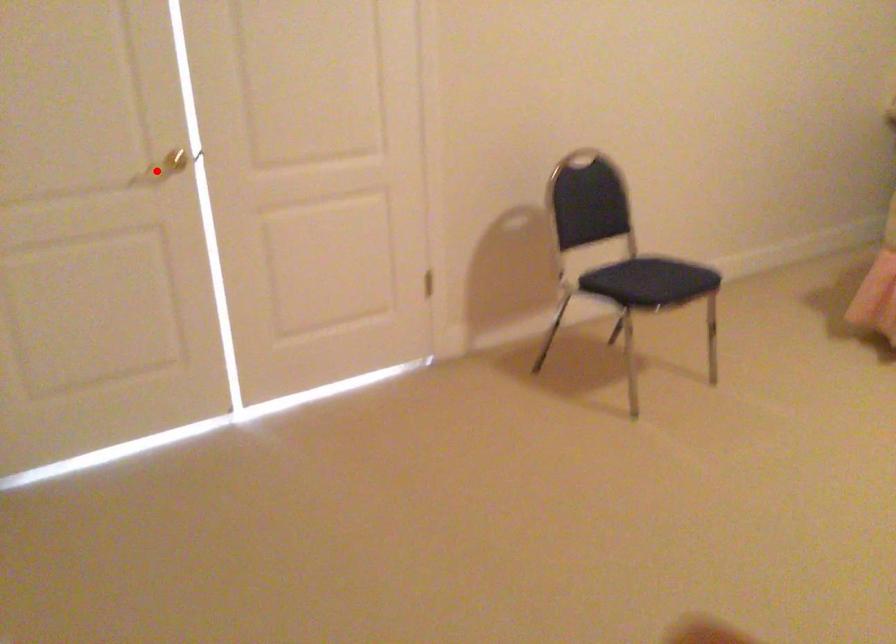
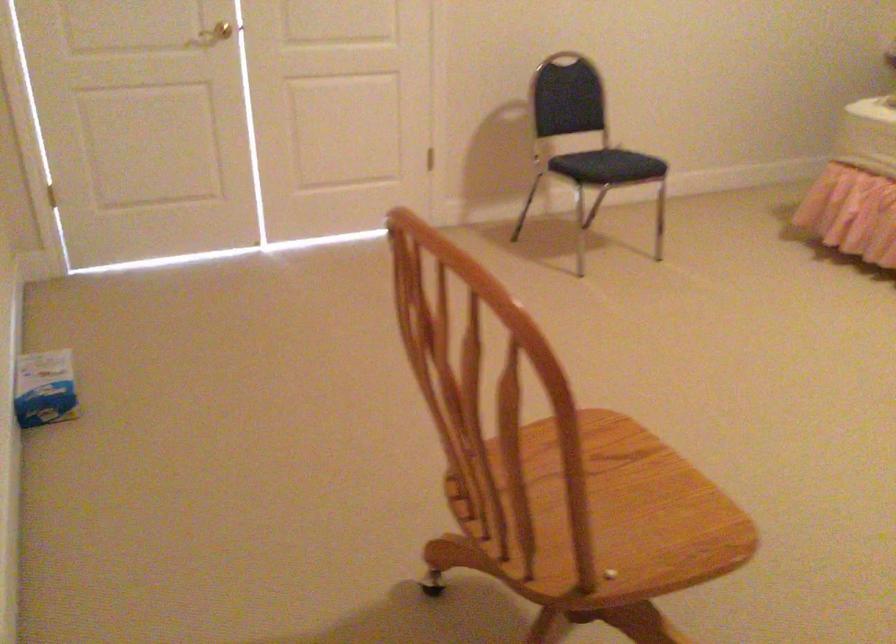
Question: I am providing you with two images of the same scene from different viewpoints. Given a red point in image1, look at the same physical point in image2. Is it:

Choices:
 (A) Closer to the viewpoint
 (B) Farther from the viewpoint

Answer: (B)